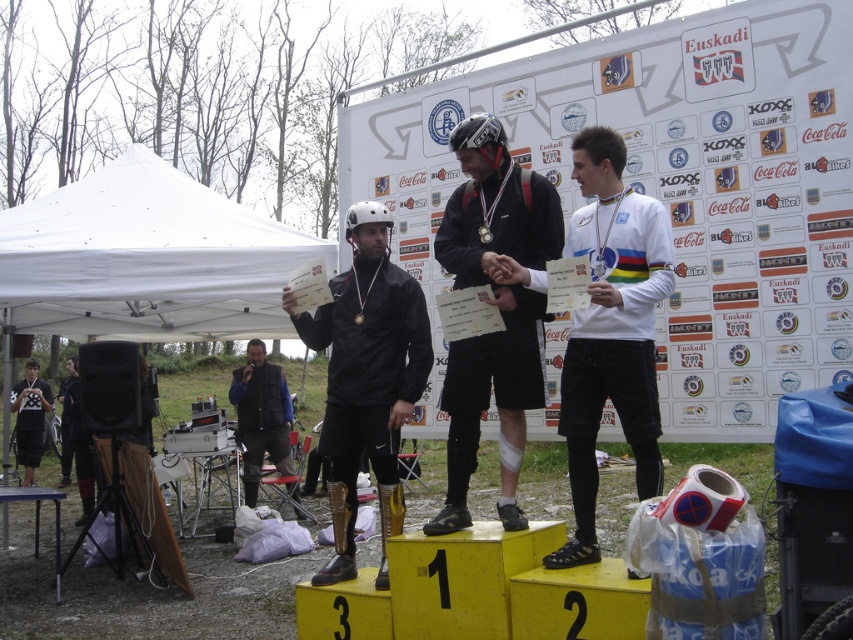
Question: Observing the image, what is the correct spatial positioning of white fabric canopy at left in reference to black leather vest at center?

Choices:
 (A) left
 (B) right

Answer: (A)

Question: Which object is farther from the camera taking this photo?

Choices:
 (A) white fabric canopy at left
 (B) black leather vest at center
 (C) black matte jacket at center
 (D) matte black helmet at center

Answer: (B)

Question: Does white fabric canopy at left appear on the right side of black leather vest at center?

Choices:
 (A) yes
 (B) no

Answer: (B)

Question: Which is nearer to the white jersey at left?

Choices:
 (A) white fabric canopy at left
 (B) black leather vest at center
 (C) black matte jacket at center

Answer: (B)

Question: Which point is closer to the camera taking this photo?

Choices:
 (A) (178, 204)
 (B) (19, 401)
 (C) (370, 310)

Answer: (C)

Question: Is black leather vest at center in front of white jersey at left?

Choices:
 (A) no
 (B) yes

Answer: (B)